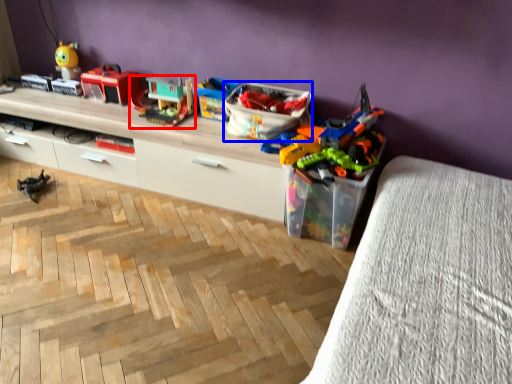
Question: Which object appears closest to the camera in this image, toy (highlighted by a red box) or storage box (highlighted by a blue box)?

Choices:
 (A) toy
 (B) storage box

Answer: (B)